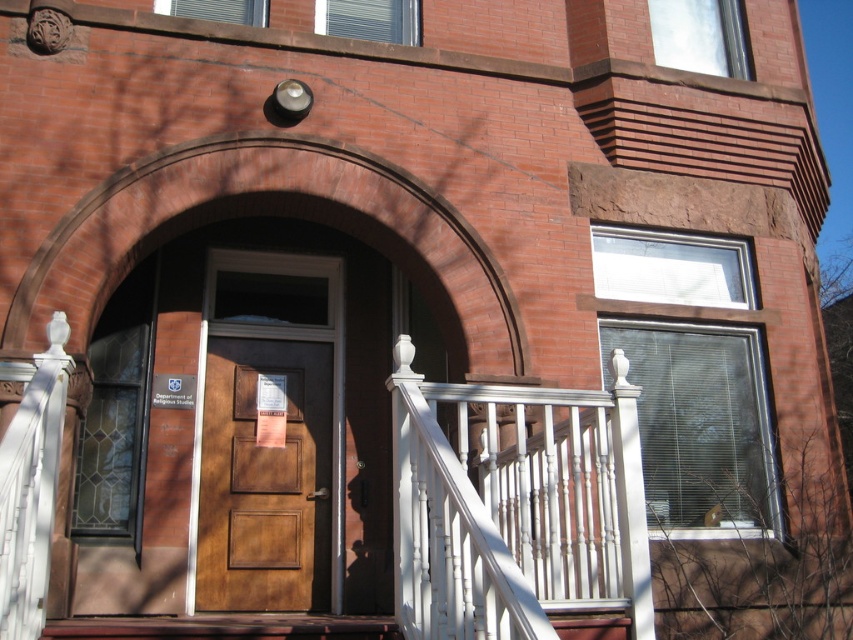
Question: Is white painted wood porch at center thinner than brown wood door at center?

Choices:
 (A) no
 (B) yes

Answer: (A)

Question: Which of the following is the closest to the observer?

Choices:
 (A) white painted wood balustrade at lower center
 (B) white painted wood porch at center
 (C) wooden stairs at center

Answer: (A)

Question: Where is white painted wood porch at center located in relation to white painted wood balustrade at lower center in the image?

Choices:
 (A) above
 (B) below

Answer: (A)

Question: Does brown wood door at center appear on the right side of wooden stairs at center?

Choices:
 (A) yes
 (B) no

Answer: (A)

Question: Which is nearer to the brown wood door at center?

Choices:
 (A) white painted wood balustrade at lower center
 (B) white painted wood porch at center
 (C) wooden stairs at center

Answer: (C)

Question: Among these objects, which one is farthest from the camera?

Choices:
 (A) white painted wood porch at center
 (B) wooden stairs at center

Answer: (B)